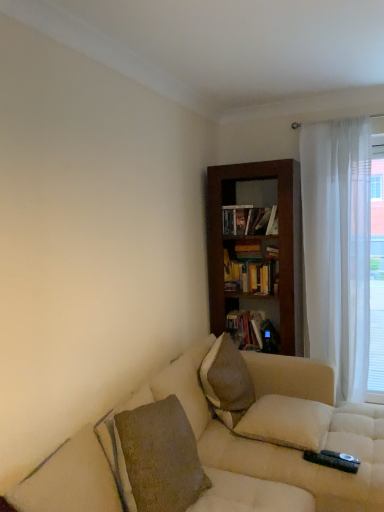
Question: Can you confirm if white sheer curtain at right is positioned to the left of white sheer curtain at right?

Choices:
 (A) yes
 (B) no

Answer: (A)

Question: From a real-world perspective, is white sheer curtain at right over white sheer curtain at right?

Choices:
 (A) no
 (B) yes

Answer: (B)

Question: From the image's perspective, is white sheer curtain at right on white sheer curtain at right?

Choices:
 (A) no
 (B) yes

Answer: (B)

Question: Is white sheer curtain at right wider than white sheer curtain at right?

Choices:
 (A) no
 (B) yes

Answer: (B)

Question: Is white sheer curtain at right facing towards white sheer curtain at right?

Choices:
 (A) no
 (B) yes

Answer: (A)

Question: Is white sheer curtain at right not near white sheer curtain at right?

Choices:
 (A) yes
 (B) no

Answer: (B)

Question: Can matte black bookshelf at center, placed as the 1th book when sorted from bottom to top, be found inside white soft pillow at lower right, which is the 1th pillow in bottom-to-top order?

Choices:
 (A) yes
 (B) no

Answer: (B)

Question: Is white soft pillow at lower right, which ranks as the 2th pillow in top-to-bottom order, oriented away from matte black bookshelf at center, placed as the 1th book when sorted from bottom to top?

Choices:
 (A) no
 (B) yes

Answer: (A)

Question: From a real-world perspective, is white soft pillow at lower right, which is the 1th pillow in bottom-to-top order, beneath matte black bookshelf at center, the third book positioned from the top?

Choices:
 (A) yes
 (B) no

Answer: (A)

Question: From the image's perspective, does white soft pillow at lower right, which is the 1th pillow in bottom-to-top order, appear higher than matte black bookshelf at center, the third book positioned from the top?

Choices:
 (A) yes
 (B) no

Answer: (B)

Question: Is white soft pillow at lower right, which ranks as the 2th pillow in top-to-bottom order, at the right side of matte black bookshelf at center, placed as the 1th book when sorted from bottom to top?

Choices:
 (A) yes
 (B) no

Answer: (A)

Question: Is white soft pillow at lower right, which is the 1th pillow in bottom-to-top order, aimed at matte black bookshelf at center, placed as the 1th book when sorted from bottom to top?

Choices:
 (A) yes
 (B) no

Answer: (B)

Question: Is dark wood bookcase at center oriented towards white soft pillow at lower right, which is the 1th pillow in bottom-to-top order?

Choices:
 (A) yes
 (B) no

Answer: (A)